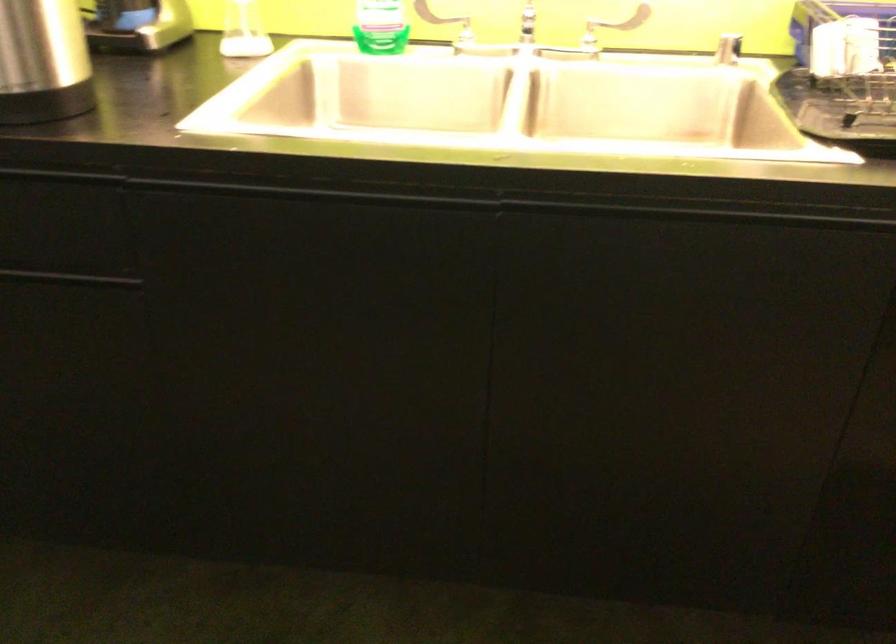
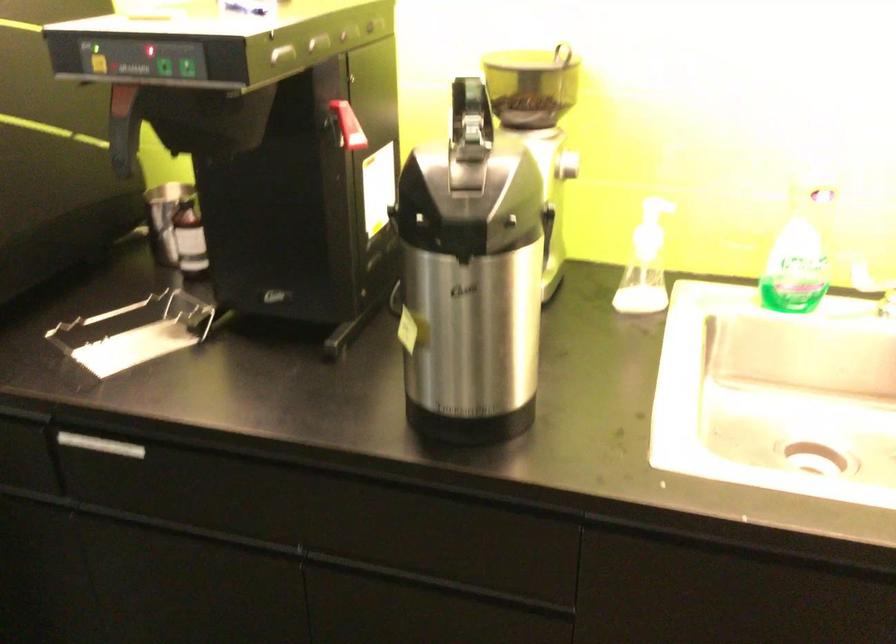
Question: Which direction would the cameraman need to move to produce the second image? Reply with the corresponding letter.

Choices:
 (A) Left
 (B) Right
 (C) Forward
 (D) Backward

Answer: (A)